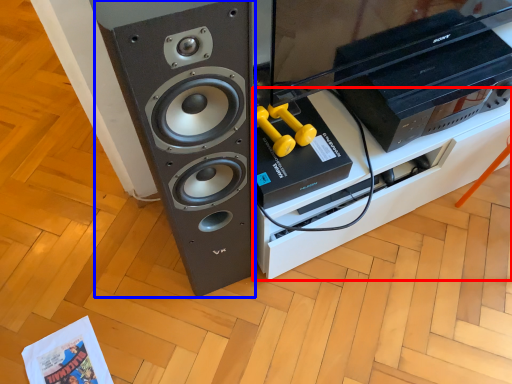
Question: Which point is further to the camera, furniture (highlighted by a red box) or speaker (highlighted by a blue box)?

Choices:
 (A) furniture
 (B) speaker

Answer: (A)